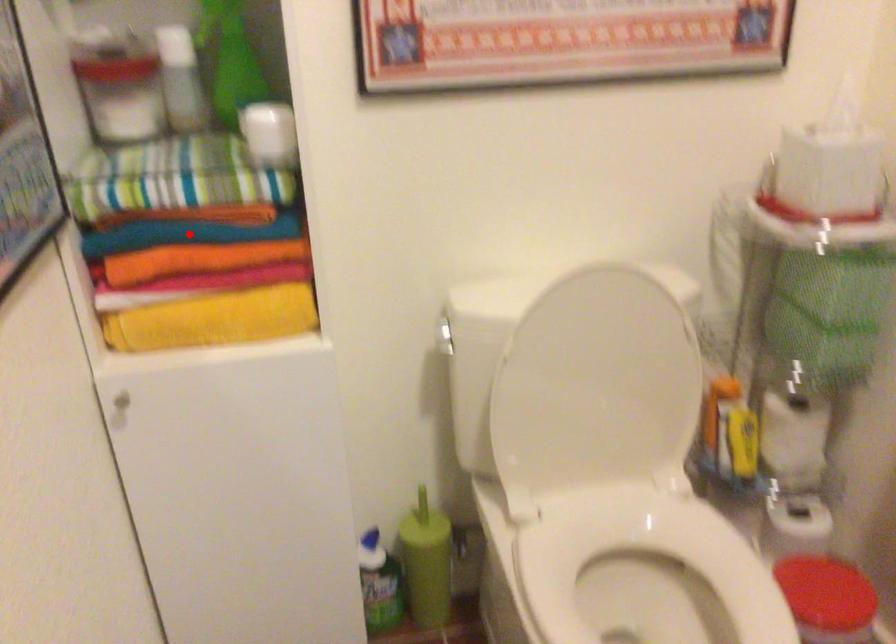
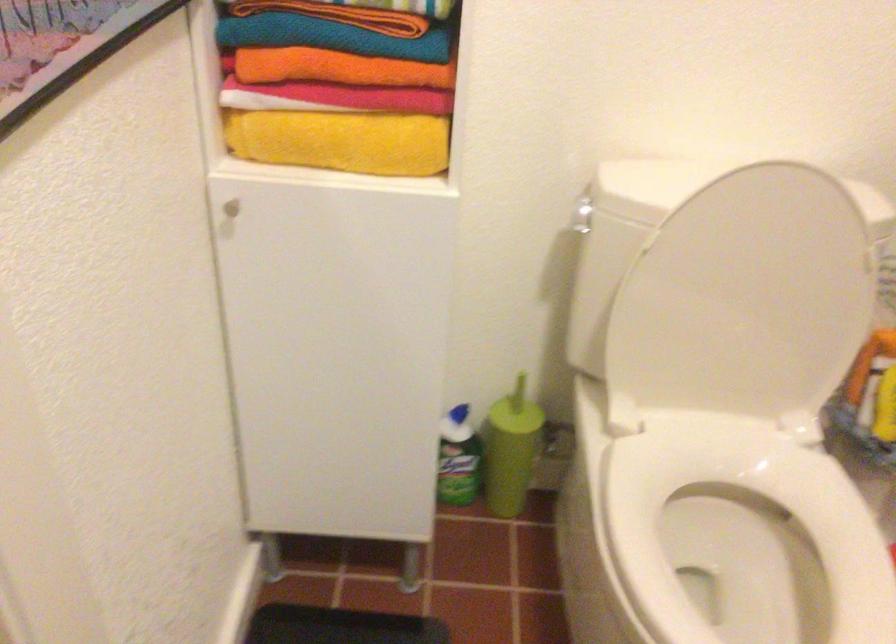
Question: A red point is marked in image1. In image2, is the corresponding 3D point closer to the camera or farther? Reply with the corresponding letter.

Choices:
 (A) The corresponding 3D point is closer.
 (B) The corresponding 3D point is farther.

Answer: (A)